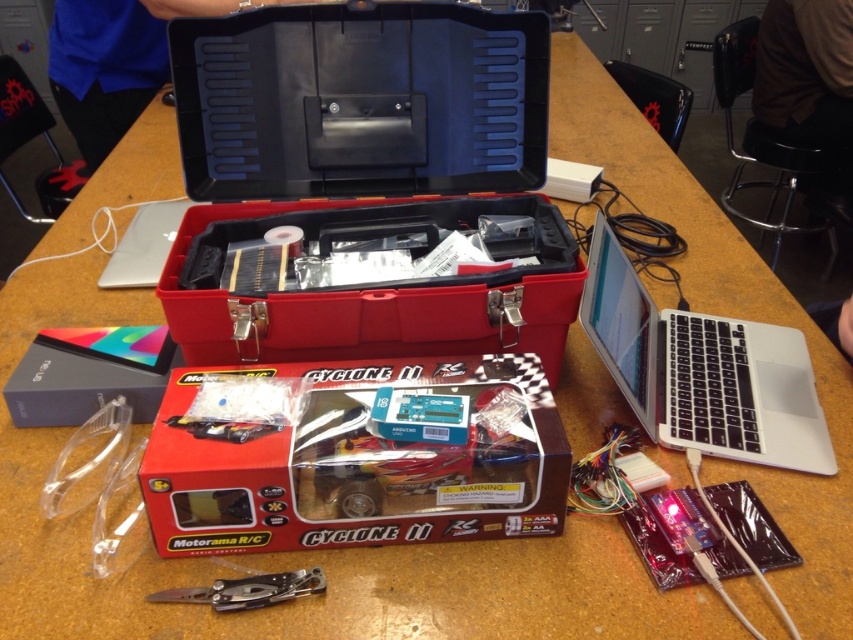
Which is below, red plastic cyclone ii rc car box at center or matte black box at lower left?

red plastic cyclone ii rc car box at center

Does red plastic cyclone ii rc car box at center have a lesser height compared to matte black box at lower left?

No.

Who is more distant from viewer, (171, 488) or (93, 333)?

Point (93, 333)

Find the location of `red plastic cyclone ii rc car box at center`. red plastic cyclone ii rc car box at center is located at coordinates (363, 461).

Who is more forward, (421, 465) or (189, 432)?

Point (421, 465) is more forward.

Does red plastic cyclone ii rc car box at center have a lesser height compared to clear plastic toy car at center?

No.

Does point (358, 381) come in front of point (242, 442)?

No, it is not.

Locate an element on the screen. The height and width of the screenshot is (640, 853). red plastic cyclone ii rc car box at center is located at coordinates (363, 461).

Does red plastic cyclone ii rc car box at center appear over silver metallic laptop at right?

No.

Can you confirm if red plastic cyclone ii rc car box at center is thinner than silver metallic laptop at right?

No.

Which is behind, point (422, 461) or point (715, 346)?

The point (715, 346) is more distant.

Locate an element on the screen. red plastic cyclone ii rc car box at center is located at coordinates (363, 461).